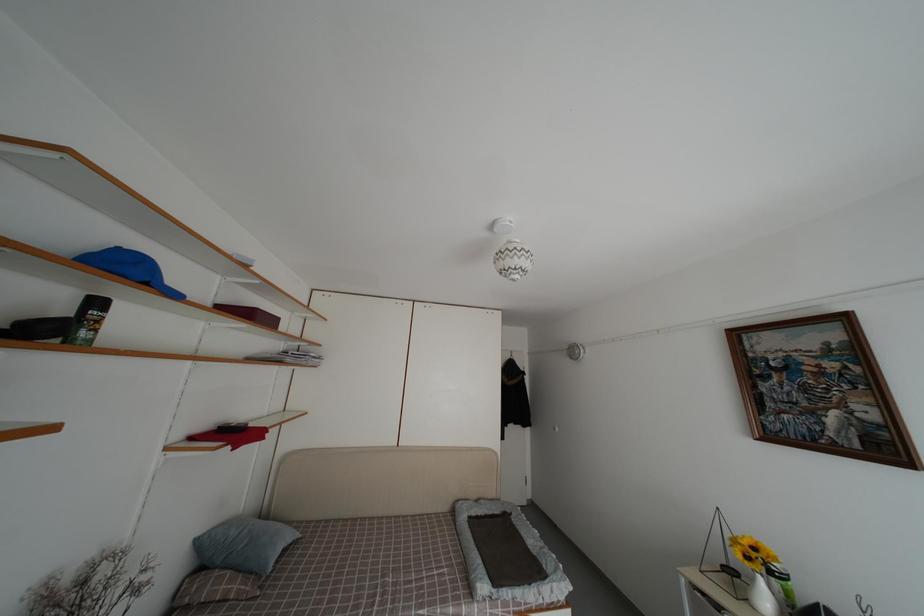
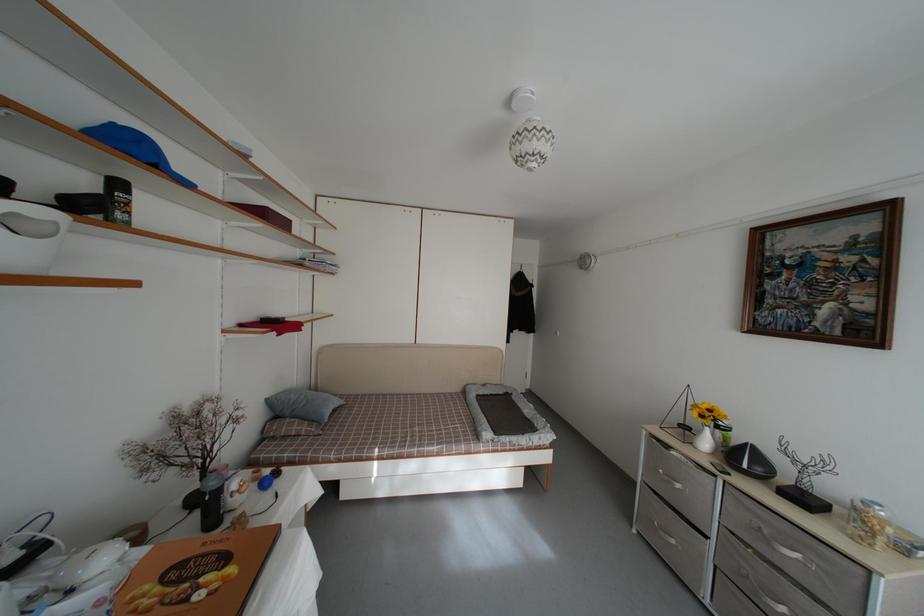
Find the pixel in the second image that matches (512,523) in the first image.

(513, 402)